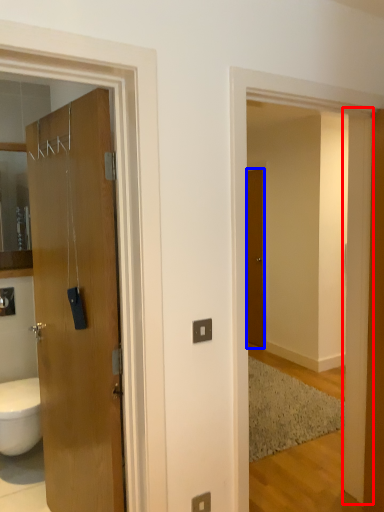
Question: Which object is closer to the camera taking this photo, pillar (highlighted by a red box) or door (highlighted by a blue box)?

Choices:
 (A) pillar
 (B) door

Answer: (A)